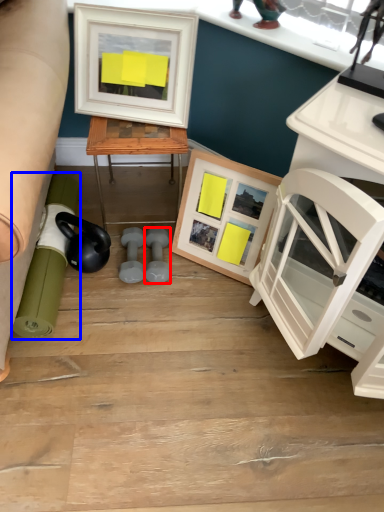
Question: Which object appears farthest to the camera in this image, dumbbell (highlighted by a red box) or rolling pin (highlighted by a blue box)?

Choices:
 (A) dumbbell
 (B) rolling pin

Answer: (A)